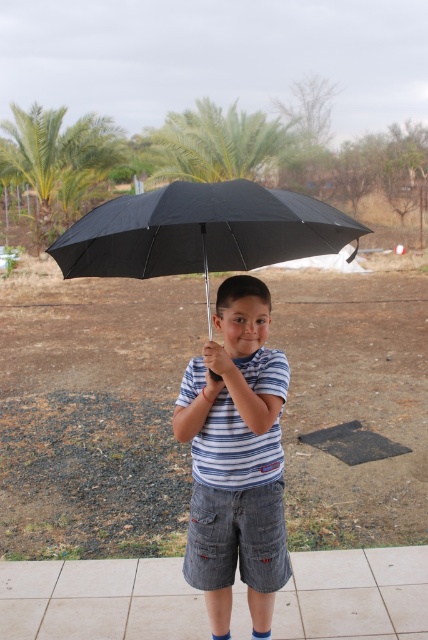
Question: Among these points, which one is nearest to the camera?

Choices:
 (A) (196, 356)
 (B) (44, 232)

Answer: (A)

Question: Which of the following is the closest to the observer?

Choices:
 (A) black matte umbrella at center
 (B) green leafy palm tree at upper left

Answer: (A)

Question: Can you confirm if green leafy palm tree at upper left is positioned above green leafy palm tree at upper center?

Choices:
 (A) yes
 (B) no

Answer: (B)

Question: Is striped cotton shirt at center above green leafy palm tree at upper center?

Choices:
 (A) yes
 (B) no

Answer: (B)

Question: Is black matte umbrella at center further to camera compared to green leafy palm tree at upper center?

Choices:
 (A) no
 (B) yes

Answer: (A)

Question: Which point appears farthest from the camera in this image?

Choices:
 (A) (30, 172)
 (B) (243, 237)
 (C) (208, 556)
 (D) (259, 160)

Answer: (D)